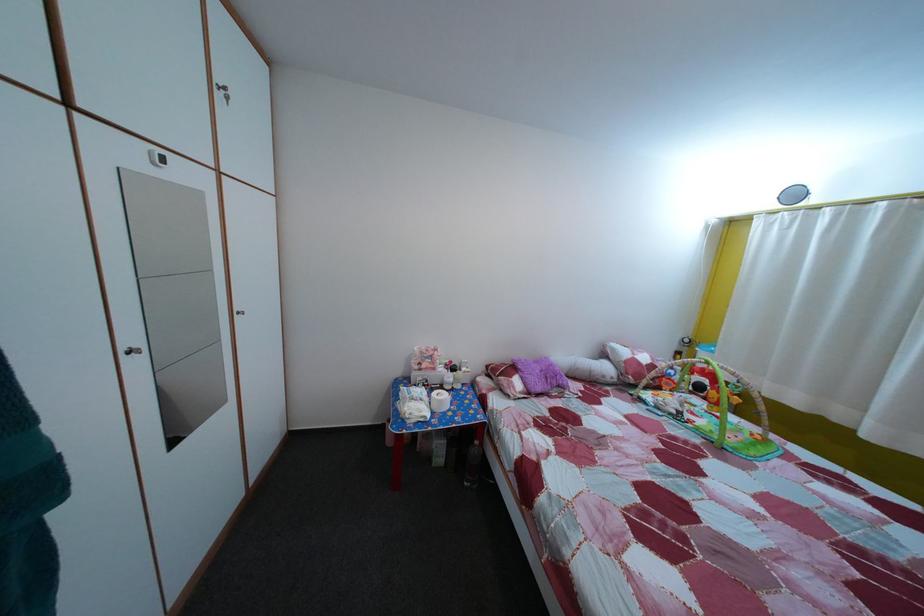
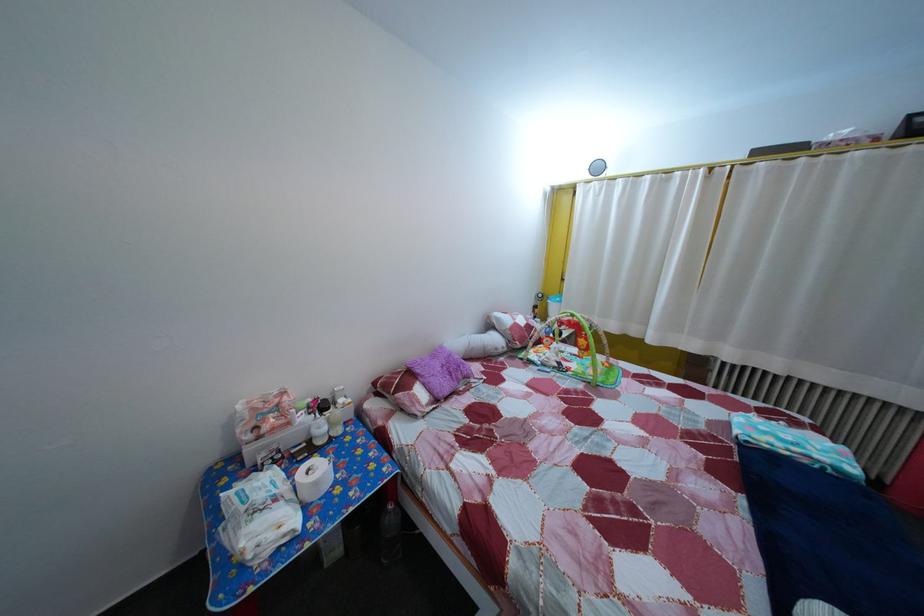
Locate, in the second image, the point that corresponds to point (893, 212) in the first image.

(659, 185)